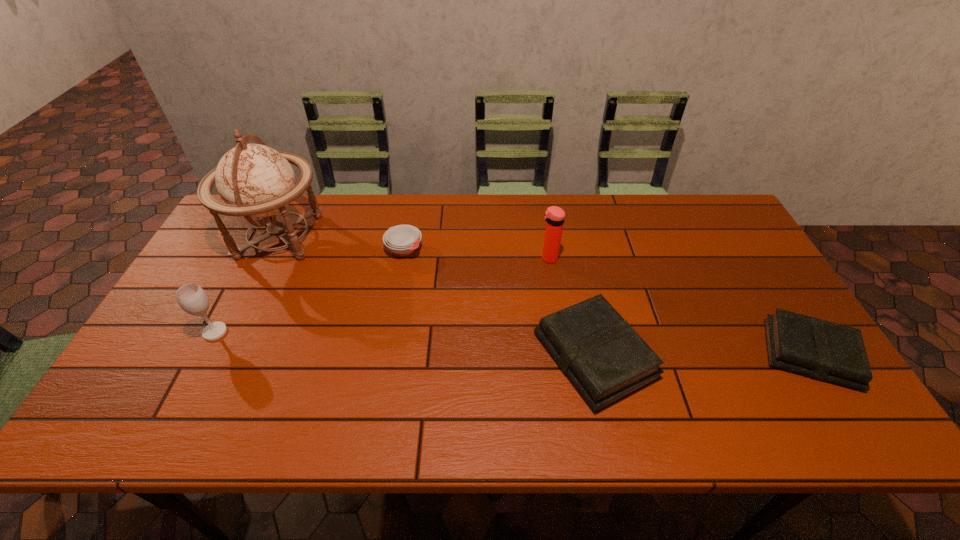
Locate an element on the screen. empty space between the soup bowl and the thermos bottle is located at coordinates (476, 254).

The image size is (960, 540). What are the coordinates of `vacant space in between the globe and the fourth shortest object` in the screenshot? It's located at (248, 284).

The height and width of the screenshot is (540, 960). What are the coordinates of `free point between the left book and the right book` in the screenshot? It's located at 702,355.

Identify the location of free spot between the fourth shortest object and the tallest object. This screenshot has height=540, width=960. (248, 284).

You are a GUI agent. You are given a task and a screenshot of the screen. Output one action in this format:
    pyautogui.click(x=<x>, y=<y>)
    Task: Click on the fifth closest object relative to the rightmost object
    
    Given the screenshot: What is the action you would take?
    pyautogui.click(x=192, y=298)

Select which object is the fifth closest to the taller book. Please provide its 2D coordinates. Your answer should be formatted as a tuple, i.e. [(x, y)], where the tuple contains the x and y coordinates of a point satisfying the conditions above.

[(192, 298)]

In order to click on free space in the image that satisfies the following two spatial constraints: 1. at the front of the tallest object showing Africa; 2. on the front side of the fourth shortest object in this screenshot , I will do `click(234, 332)`.

Locate an element on the screen. The width and height of the screenshot is (960, 540). vacant space that satisfies the following two spatial constraints: 1. at the front of the globe showing Africa; 2. on the back side of the taller book is located at coordinates (223, 356).

You are a GUI agent. You are given a task and a screenshot of the screen. Output one action in this format:
    pyautogui.click(x=<x>, y=<y>)
    Task: Click on the free region that satisfies the following two spatial constraints: 1. on the front side of the right book; 2. on the left side of the thermos bottle
    
    Given the screenshot: What is the action you would take?
    pyautogui.click(x=564, y=354)

I want to click on vacant space that satisfies the following two spatial constraints: 1. on the back side of the soup bowl; 2. at the front of the globe showing Africa, so pos(406,237).